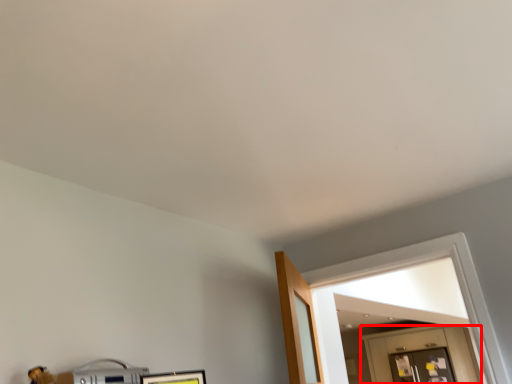
Question: Where is door (annotated by the red box) located in relation to glass door in the image?

Choices:
 (A) right
 (B) left

Answer: (A)